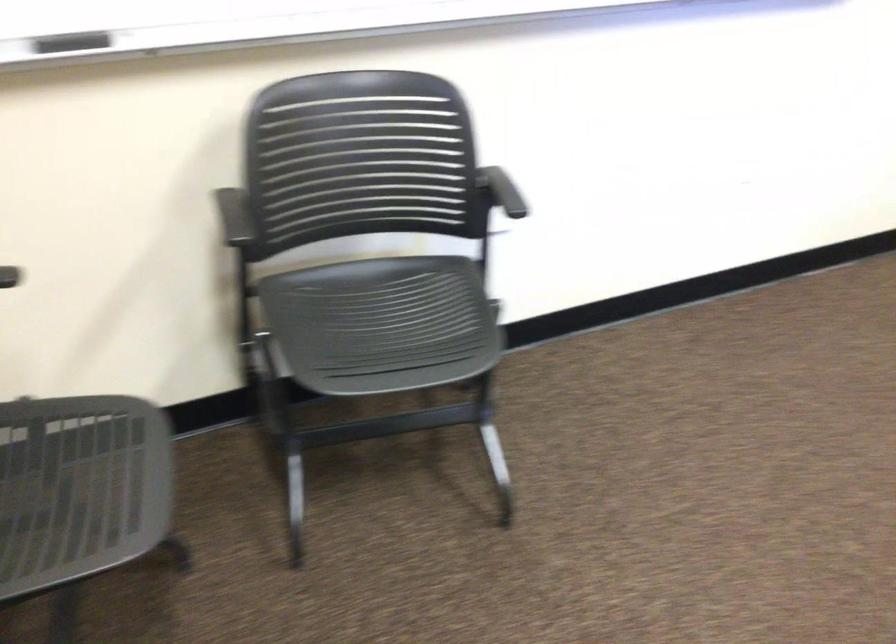
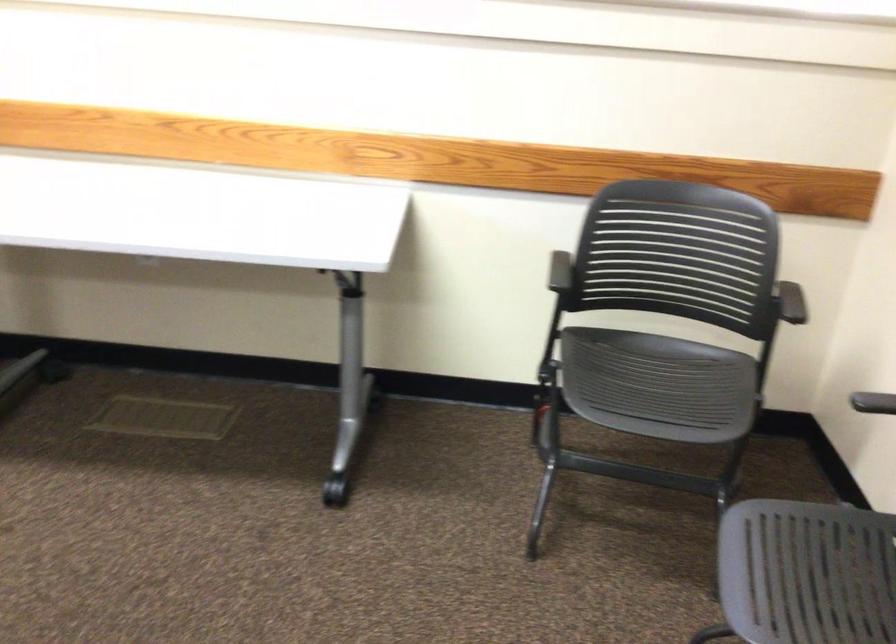
Find the pixel in the second image that matches point 358,346 in the first image.

(806, 573)